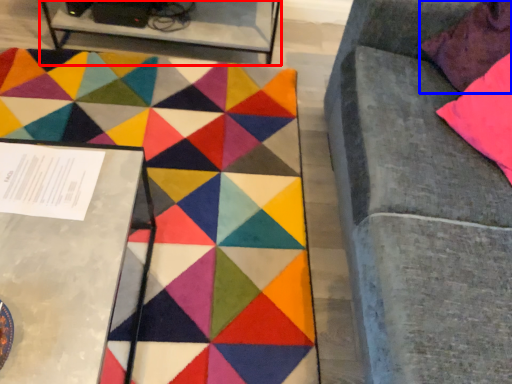
Question: Among these objects, which one is nearest to the camera, table (highlighted by a red box) or pillow (highlighted by a blue box)?

Choices:
 (A) table
 (B) pillow

Answer: (B)